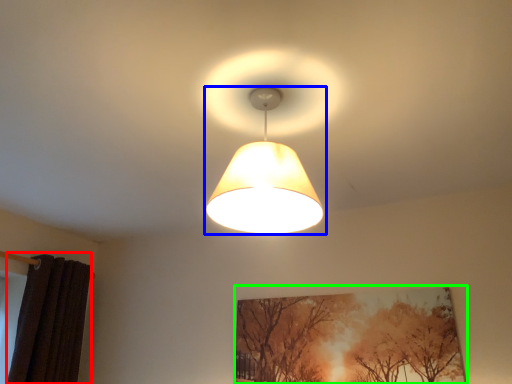
Question: Which is farther away from curtain (highlighted by a red box)? lamp (highlighted by a blue box) or picture frame (highlighted by a green box)?

Choices:
 (A) lamp
 (B) picture frame

Answer: (A)